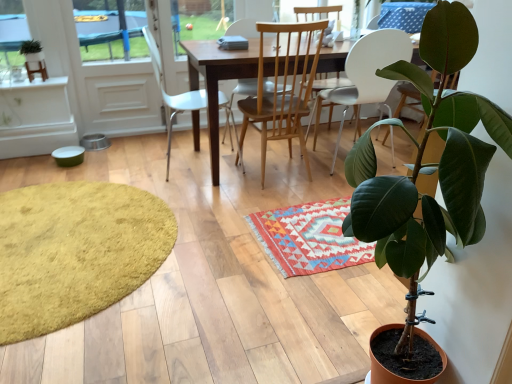
The width and height of the screenshot is (512, 384). What are the coordinates of `vacant space underneath multicolored woven rug at center, marked as the 2th mat in a left-to-right arrangement (from a real-world perspective)` in the screenshot? It's located at (313, 228).